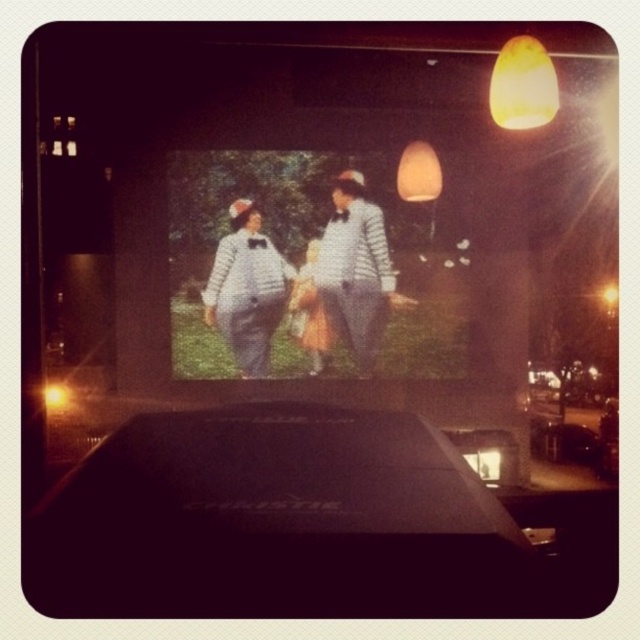
Between point (212, 177) and point (244, 333), which one is positioned in front?

Positioned in front is point (212, 177).

Between point (316, 225) and point (272, 257), which one is positioned behind?

Point (272, 257)

Locate an element on the screen. The image size is (640, 640). striped fabric characters at center is located at coordinates (300, 275).

What are the coordinates of `striped fabric characters at center` in the screenshot? It's located at (300, 275).

Does point (218, 344) lie behind point (342, 186)?

No, it is not.

What are the coordinates of `striped fabric characters at center` in the screenshot? It's located at (300, 275).

The height and width of the screenshot is (640, 640). In order to click on striped fabric dress at center in this screenshot , I will do `click(355, 272)`.

Which is in front, point (323, 275) or point (257, 321)?

Positioned in front is point (257, 321).

I want to click on striped fabric dress at center, so click(355, 272).